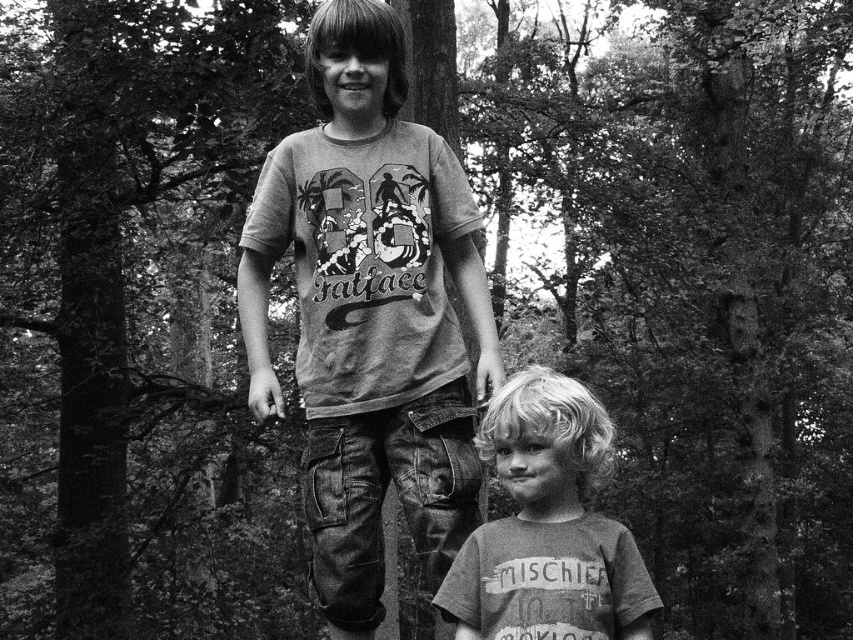
Who is lower down, matte gray t-shirt at center or matte gray t-shirt at lower center?

matte gray t-shirt at lower center

Does point (363, 240) lie in front of point (485, 586)?

No.

Is point (335, 250) more distant than point (555, 516)?

Yes, it is.

The width and height of the screenshot is (853, 640). I want to click on matte gray t-shirt at center, so click(370, 314).